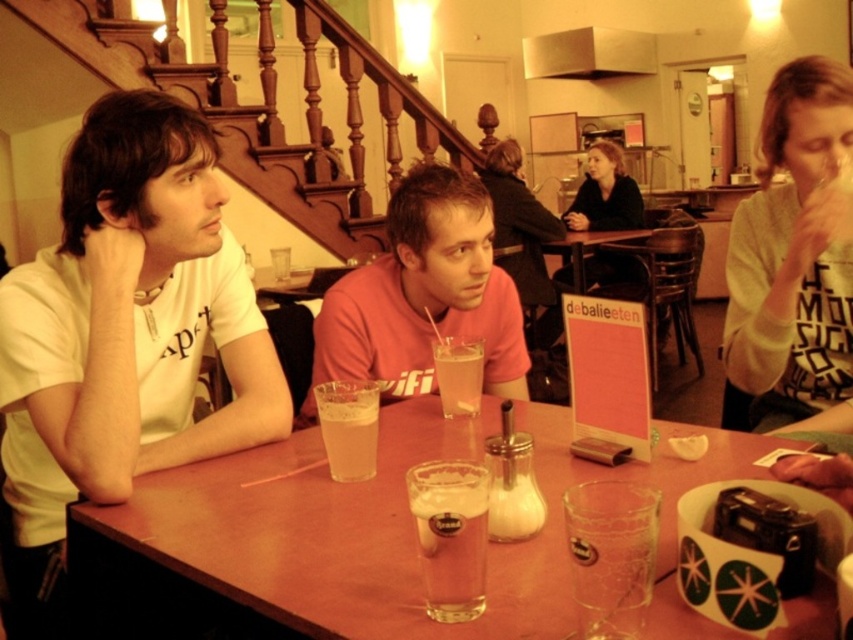
Question: Can you confirm if translucent glass table at center is positioned to the right of pink matte shirt at center?

Choices:
 (A) yes
 (B) no

Answer: (A)

Question: Among these points, which one is nearest to the camera?

Choices:
 (A) (412, 272)
 (B) (822, 400)

Answer: (B)

Question: Considering the real-world distances, which object is closest to the light beige sweater at right?

Choices:
 (A) white creamy milkshake at table center
 (B) black matte jacket at center
 (C) clear glass at table center

Answer: (C)

Question: Which of the following is the farthest from the observer?

Choices:
 (A) clear glass at table center
 (B) clear glass beer at table center
 (C) translucent glass table at center
 (D) white matte t-shirt at left

Answer: (A)

Question: Is white matte t-shirt at left smaller than black matte jacket at center?

Choices:
 (A) no
 (B) yes

Answer: (B)

Question: Considering the relative positions of clear glass beer at table center and translucent glass at table center in the image provided, where is clear glass beer at table center located with respect to translucent glass at table center?

Choices:
 (A) below
 (B) above

Answer: (A)